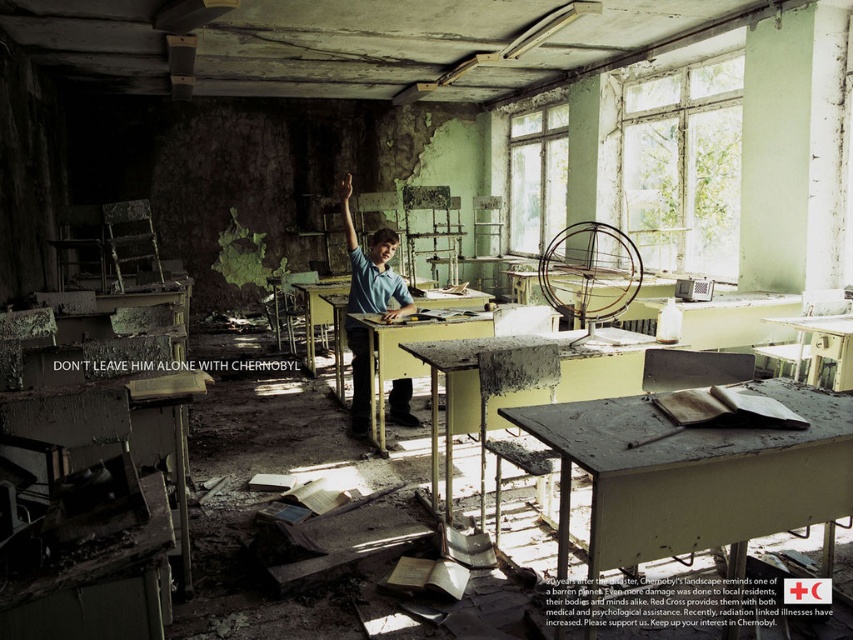
In the abandoned classroom scene, there are two desks at the center. The first is a matte gray desk at center and the second is a matte yellow desk at center. From the perspective of someone standing at the entrance facing the room, which desk is positioned to the left?

The matte gray desk at center is to the left of the matte yellow desk at center, so from the entrance perspective, the matte gray desk at center would be on the left side.

You are standing in the abandoned classroom and want to move from the point at coordinates point (564, 352) to the point at coordinates point (316, 282). Which direction should you move?

You should move backward because point (564, 352) is in front of point (316, 282), so moving backward will take you towards the latter point.

You are standing in the middle of the room and want to move to the matte gray desk at center. Which direction should you move to reach it?

Since the matte gray desk at center is located at point (520,388), you should move towards the center of the room to reach it.